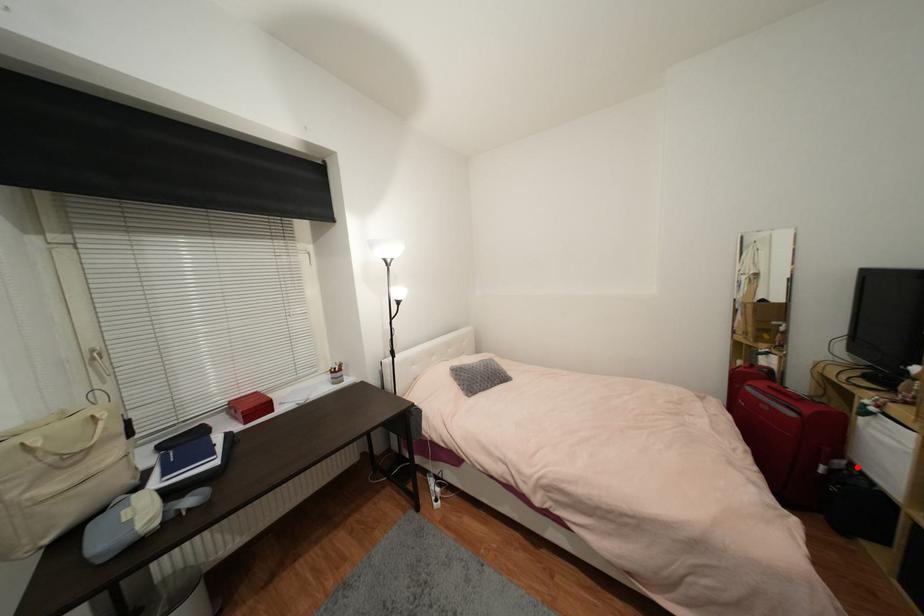
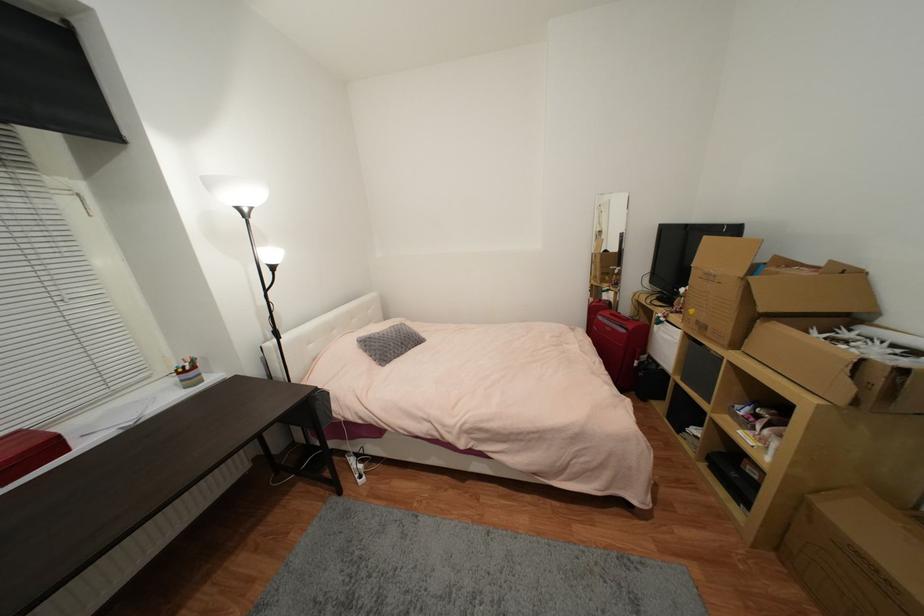
Find the pixel in the second image that matches the highlighted location in the first image.

(653, 359)